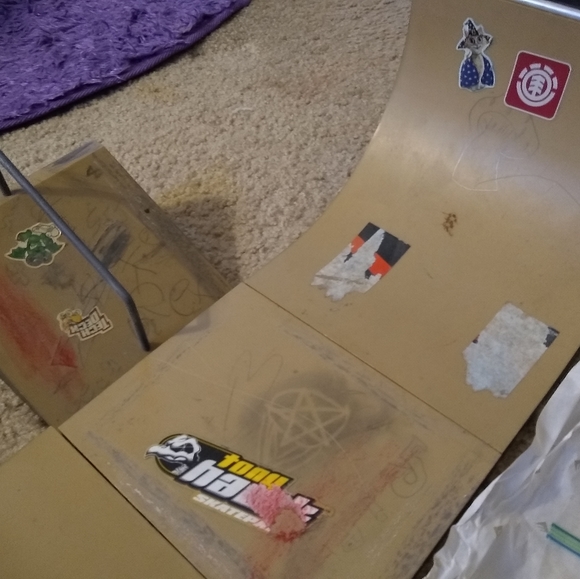
Where is `stickers`? Image resolution: width=580 pixels, height=579 pixels. stickers is located at coordinates (31, 234), (90, 317), (219, 472), (494, 348), (374, 261), (473, 69), (532, 75).